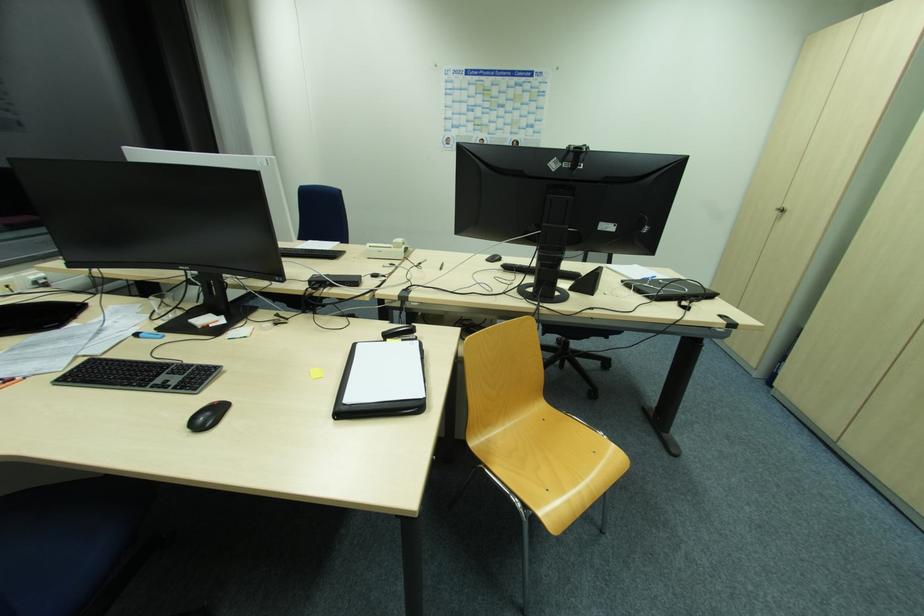
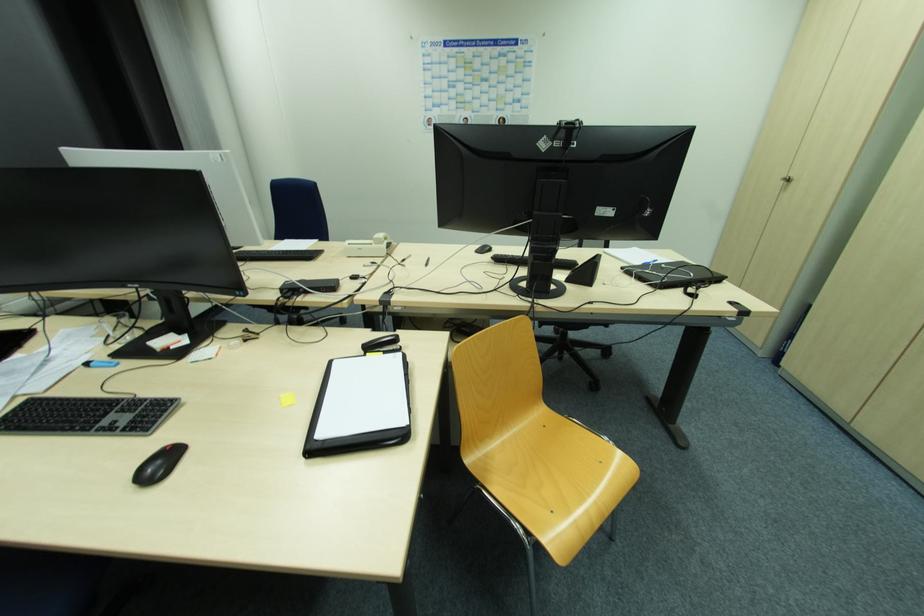
Find the pixel in the second image that matches (139,334) in the first image.

(90, 365)